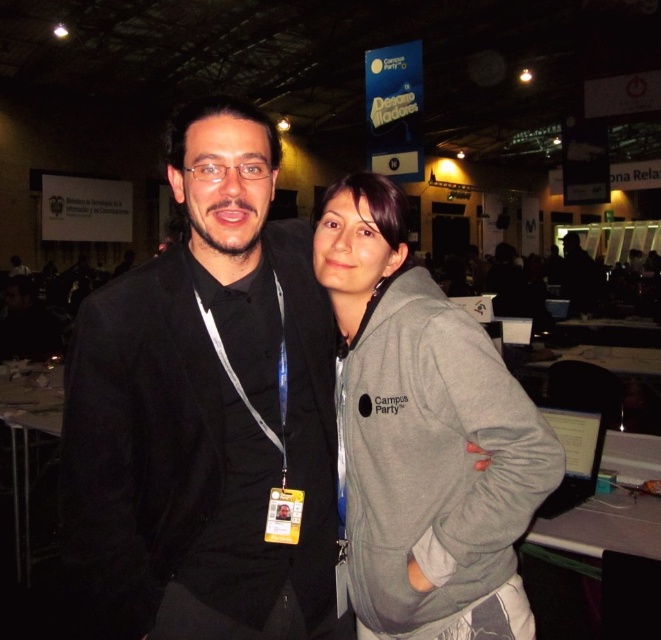
You are a photographer standing in the large hall at the Campus Party event. You want to take a photo of the black matte suit at center from where you are standing. Considering the distance between you and the suit, will you be able to capture the entire suit in a single frame without moving closer?

The black matte suit at center is 1.03 meters away from the viewer. Depending on the camera lens used, this distance may allow capturing the entire suit in one frame, but it might require a wide angle lens to avoid cropping parts of the suit.

From the picture: You are at a conference and want to take a photo of the black matte suit at center. Which coordinates should you aim your camera at?

You should aim your camera at coordinates point (x=204, y=412) to capture the black matte suit at center.

You are organizing a clothing donation drive and need to determine which items can fit into a standard donation box. The box can only accommodate clothing items that are smaller than a certain size. Given the black matte suit at center and the gray fleece jacket at center, which one is more likely to fit into the donation box?

The gray fleece jacket at center is smaller than the black matte suit at center, so it is more likely to fit into the donation box.